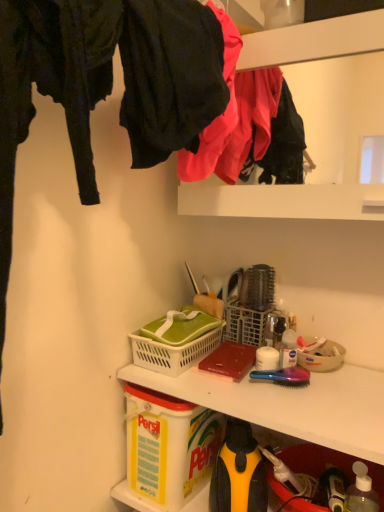
Question: From a real-world perspective, relative to white plastic bottle at center, the 1th bottle from the back, is matte black pants at upper left, which ranks as the second clothing in back-to-front order, vertically above or below?

Choices:
 (A) above
 (B) below

Answer: (A)

Question: Based on their positions, is matte black pants at upper left, which is the first clothing in front-to-back order, located to the left or right of white plastic bottle at center, acting as the 1th bottle starting from the left?

Choices:
 (A) left
 (B) right

Answer: (A)

Question: Which object is positioned closest to the matte plastic clothes at upper center?

Choices:
 (A) white plastic bottle at center, the 1th bottle from the back
 (B) white plastic picnic basket at center
 (C) yellow plastic container at lower left
 (D) matte pink fabric at upper center, acting as the 1th clothing starting from the back
 (E) beige plastic bowl at center right

Answer: (D)

Question: Which is nearer to the matte pink fabric at upper center, the 2th clothing in the front-to-back sequence?

Choices:
 (A) matte plastic clothes at upper center
 (B) white plastic picnic basket at center
 (C) beige plastic bowl at center right
 (D) yellow plastic container at lower left
 (E) matte black pants at upper left, which ranks as the second clothing in back-to-front order

Answer: (E)